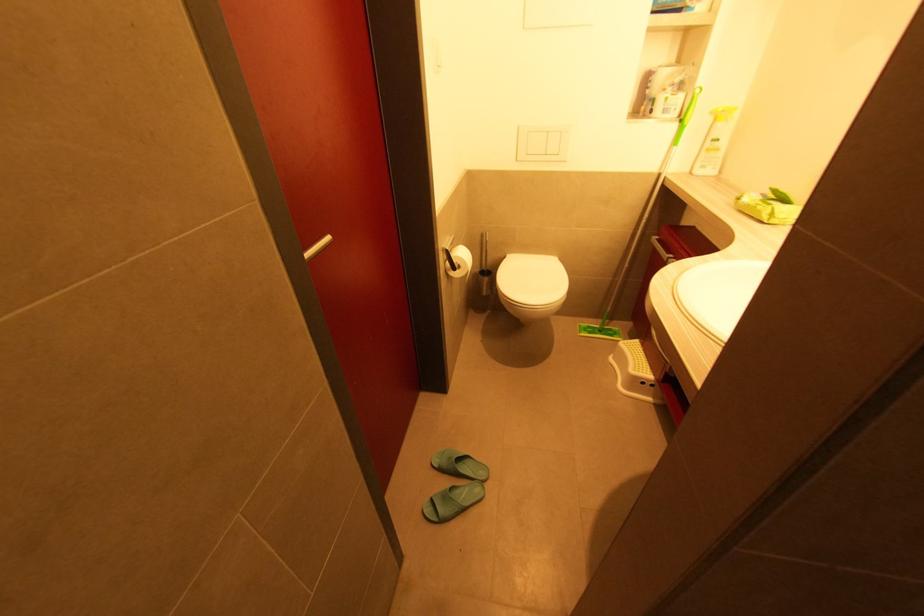
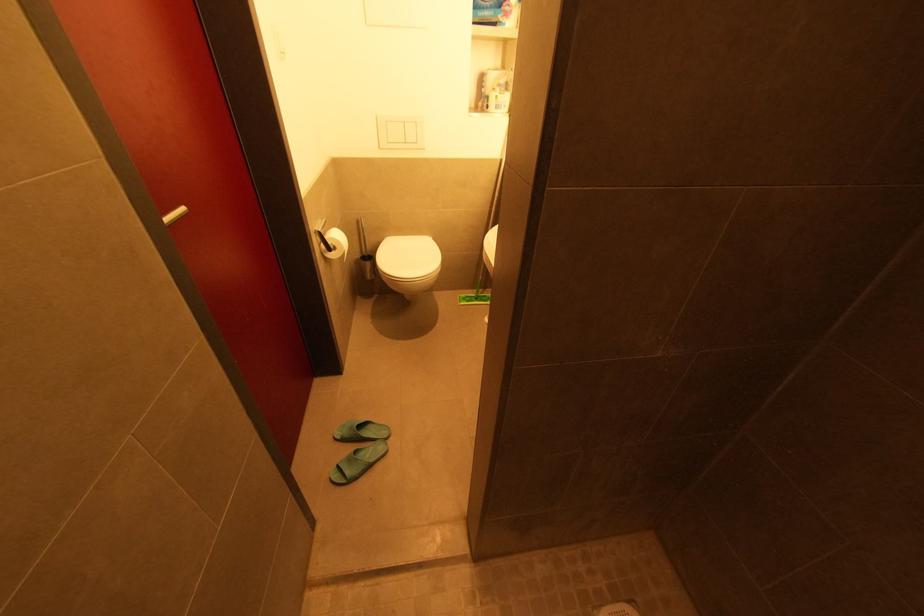
Question: The images are taken continuously from a first-person perspective. In which direction are you moving?

Choices:
 (A) Left
 (B) Right
 (C) Forward
 (D) Backward

Answer: (D)